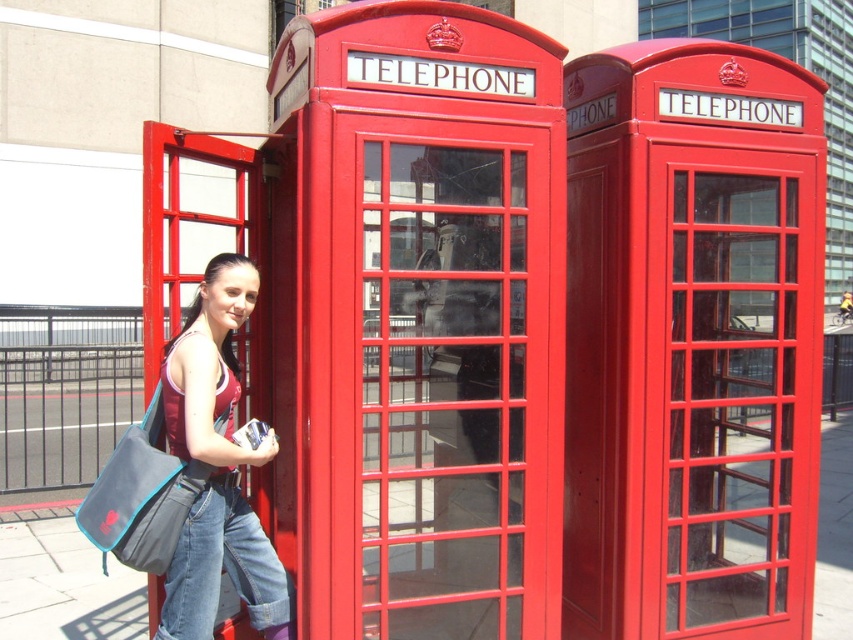
You are a photographer wanting to capture both the matte red telephone at center and the metallic red telephone booth at right in a single frame. Based on their positions, which one should you position closer to the left side of your camera viewfinder to include both in the shot?

The matte red telephone at center is already positioned to the left of the metallic red telephone booth at right, so to include both in the shot, you should position the matte red telephone at center closer to the left side of your camera viewfinder.

You are a photographer trying to capture a clear shot of the matte red telephone at center and the matte fabric tank top at center. Which object should you focus on first if you want to ensure both are in focus without adjusting your camera settings?

The matte red telephone at center is taller than the matte fabric tank top at center, so focusing on the taller object first would help ensure both are in focus.